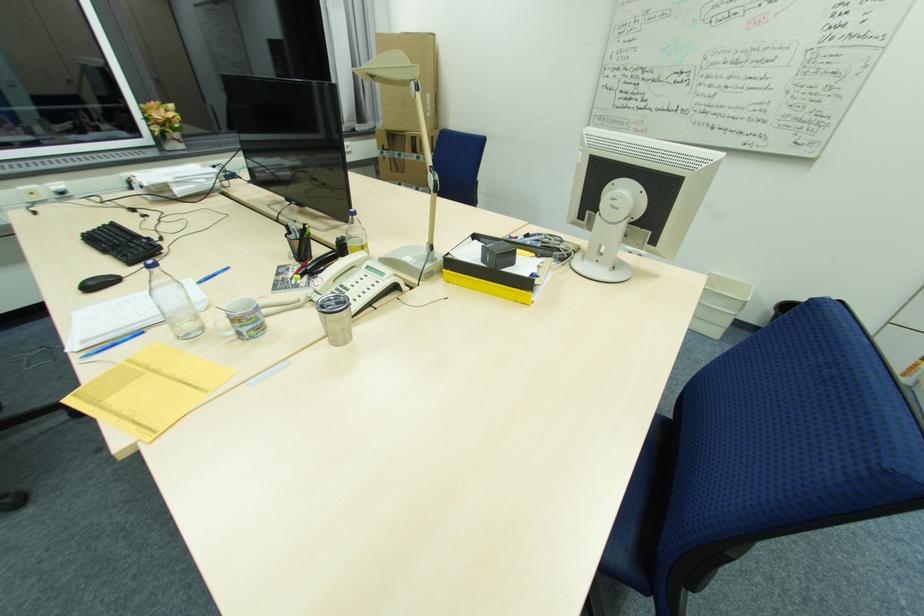
Locate an element on the screen. This screenshot has height=616, width=924. clear glass bottle is located at coordinates (173, 302).